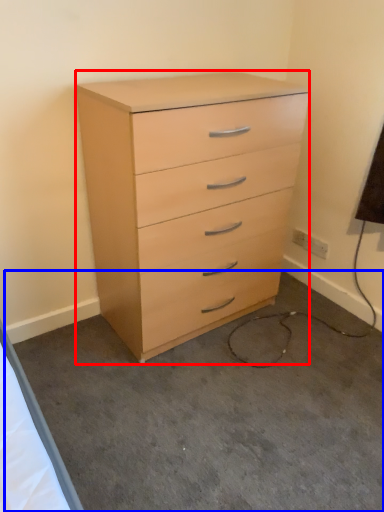
Question: Which point is closer to the camera, chest of drawers (highlighted by a red box) or concrete (highlighted by a blue box)?

Choices:
 (A) chest of drawers
 (B) concrete

Answer: (B)